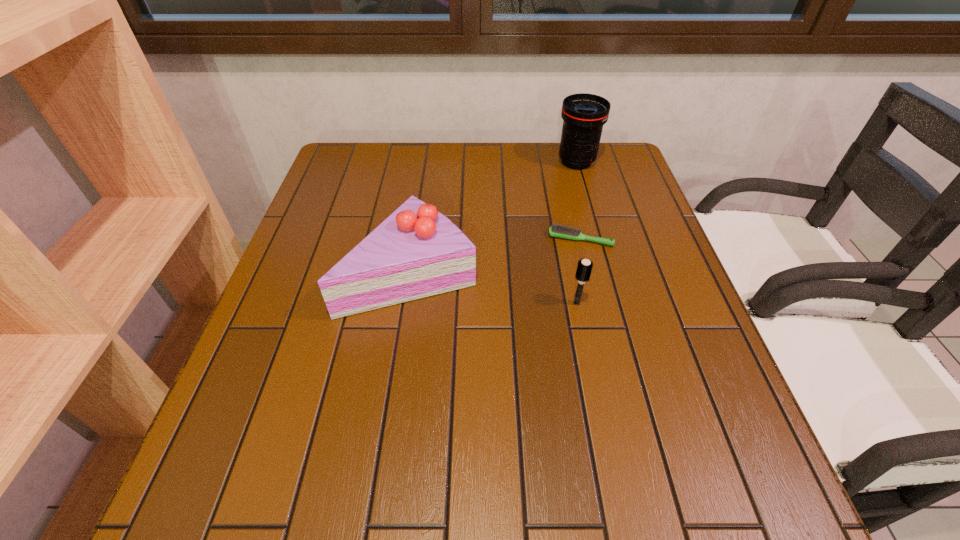
This screenshot has height=540, width=960. I want to click on free space between the cake and the taller hairbrush, so click(x=493, y=288).

Find the location of `vacant area that lies between the telephoto lens and the leftmost object`. vacant area that lies between the telephoto lens and the leftmost object is located at coordinates (493, 217).

Where is `vacant space that is in between the telephoto lens and the shorter hairbrush`? The height and width of the screenshot is (540, 960). vacant space that is in between the telephoto lens and the shorter hairbrush is located at coordinates (579, 200).

I want to click on empty location between the leftmost object and the farther hairbrush, so pyautogui.click(x=495, y=256).

This screenshot has width=960, height=540. I want to click on blank region between the shortest object and the leftmost object, so click(495, 256).

Image resolution: width=960 pixels, height=540 pixels. I want to click on vacant area between the leftmost object and the farthest object, so click(493, 217).

The height and width of the screenshot is (540, 960). Identify the location of vacant space that's between the cake and the shortest object. (495, 256).

Identify which object is located as the third nearest to the nearer hairbrush. Please provide its 2D coordinates. Your answer should be formatted as a tuple, i.e. [(x, y)], where the tuple contains the x and y coordinates of a point satisfying the conditions above.

[(583, 114)]

Identify which object is the second closest to the cake. Please provide its 2D coordinates. Your answer should be formatted as a tuple, i.e. [(x, y)], where the tuple contains the x and y coordinates of a point satisfying the conditions above.

[(584, 268)]

You are a GUI agent. You are given a task and a screenshot of the screen. Output one action in this format:
    pyautogui.click(x=<x>, y=<y>)
    Task: Click on the free location that satisfies the following two spatial constraints: 1. on the back side of the farthest object; 2. on the left side of the cake
    
    Given the screenshot: What is the action you would take?
    pyautogui.click(x=427, y=162)